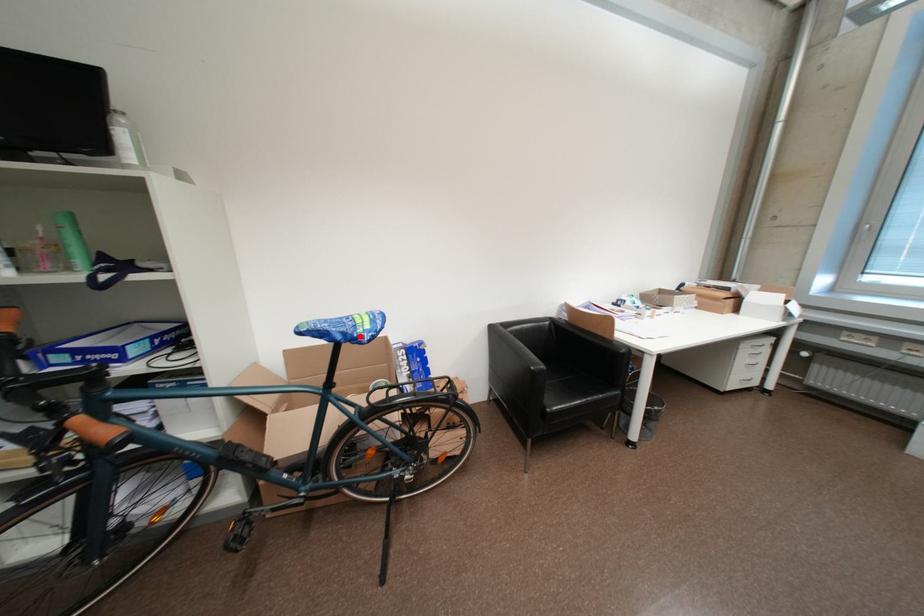
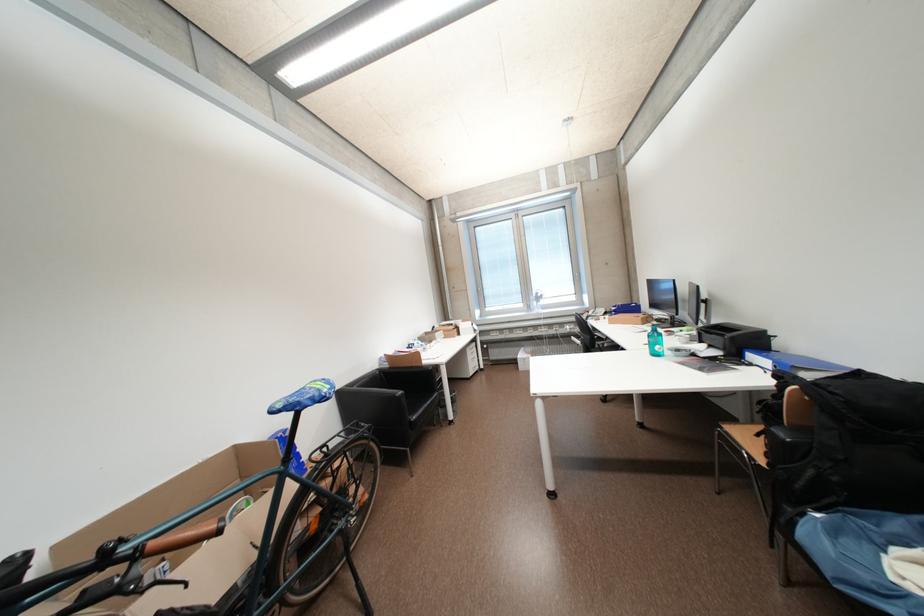
Where in the second image is the point corresponding to the highlighted location from the first image?

(329, 398)